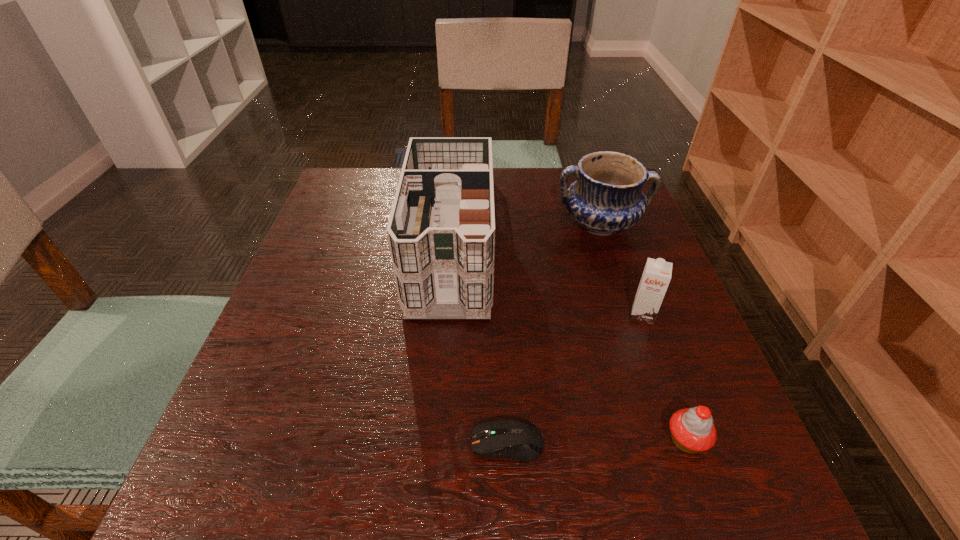
This screenshot has height=540, width=960. In order to click on free point between the tallest object and the third shortest object in this screenshot , I will do [547, 274].

Image resolution: width=960 pixels, height=540 pixels. Identify the location of empty location between the pottery and the dollhouse. (526, 228).

This screenshot has width=960, height=540. I want to click on empty location between the dollhouse and the shortest object, so click(479, 338).

Where is `free point between the shortest object and the pottery`? The image size is (960, 540). free point between the shortest object and the pottery is located at coordinates (554, 334).

Image resolution: width=960 pixels, height=540 pixels. I want to click on empty location between the dollhouse and the third shortest object, so coord(547,274).

Image resolution: width=960 pixels, height=540 pixels. Identify the location of free space between the second tallest object and the cupcake. (643, 332).

Image resolution: width=960 pixels, height=540 pixels. What are the coordinates of `vacant space that's between the fourth tallest object and the second tallest object` in the screenshot? It's located at (643, 332).

Select which object appears as the second closest to the shortest object. Please provide its 2D coordinates. Your answer should be formatted as a tuple, i.e. [(x, y)], where the tuple contains the x and y coordinates of a point satisfying the conditions above.

[(441, 231)]

Choose which object is the third nearest neighbor to the tallest object. Please provide its 2D coordinates. Your answer should be formatted as a tuple, i.e. [(x, y)], where the tuple contains the x and y coordinates of a point satisfying the conditions above.

[(656, 276)]

The width and height of the screenshot is (960, 540). I want to click on vacant area in the image that satisfies the following two spatial constraints: 1. on the front side of the cupcake; 2. on the left side of the second tallest object, so click(x=672, y=440).